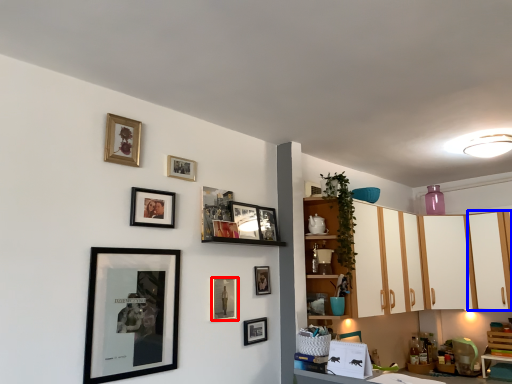
Question: Which point is further to the camera, picture frame (highlighted by a red box) or cabinetry (highlighted by a blue box)?

Choices:
 (A) picture frame
 (B) cabinetry

Answer: (B)